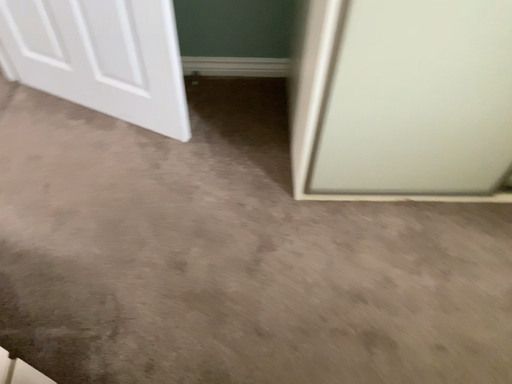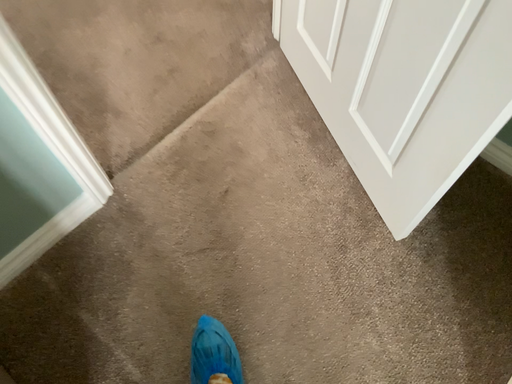
Question: How did the camera likely rotate when shooting the video?

Choices:
 (A) rotated right
 (B) rotated left

Answer: (B)